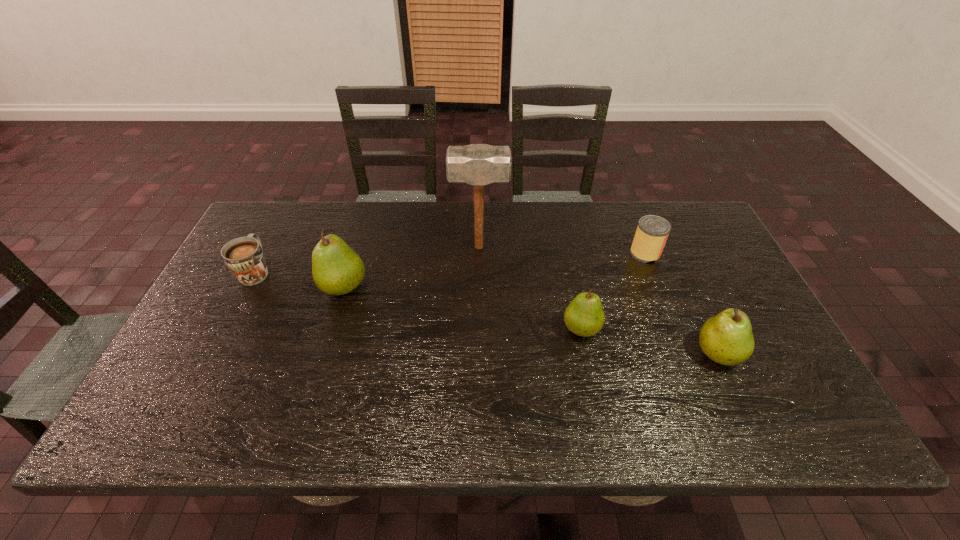
You are a GUI agent. You are given a task and a screenshot of the screen. Output one action in this format:
    pyautogui.click(x=<x>, y=<y>)
    Task: Click on the blank space located 0.190m on the back of the farthest pear
    The image size is (960, 540).
    Given the screenshot: What is the action you would take?
    pyautogui.click(x=362, y=228)

In order to click on blank space located on the back of the second pear from right to left in this screenshot , I will do `click(566, 256)`.

At what (x,y) coordinates should I click in order to perform the action: click on vacant region located 0.070m on the right of the second shortest pear. Please return your answer as a coordinate pair (x, y). Looking at the image, I should click on (770, 354).

This screenshot has height=540, width=960. In order to click on free location located on the striking face of the mallet in this screenshot , I will do `click(526, 247)`.

The width and height of the screenshot is (960, 540). I want to click on vacant point located on the side of the mug with the handle, so click(290, 205).

This screenshot has height=540, width=960. In order to click on free space located 0.220m on the side of the mug with the handle in this screenshot , I will do `click(287, 211)`.

Where is `free space located 0.090m on the side of the mug with the handle`? free space located 0.090m on the side of the mug with the handle is located at coordinates (275, 235).

The height and width of the screenshot is (540, 960). Identify the location of vacant space located on the back of the can. (633, 221).

Where is `mallet that is at the far edge`? mallet that is at the far edge is located at coordinates (477, 164).

Where is `can situated at the far edge`? The image size is (960, 540). can situated at the far edge is located at coordinates (652, 232).